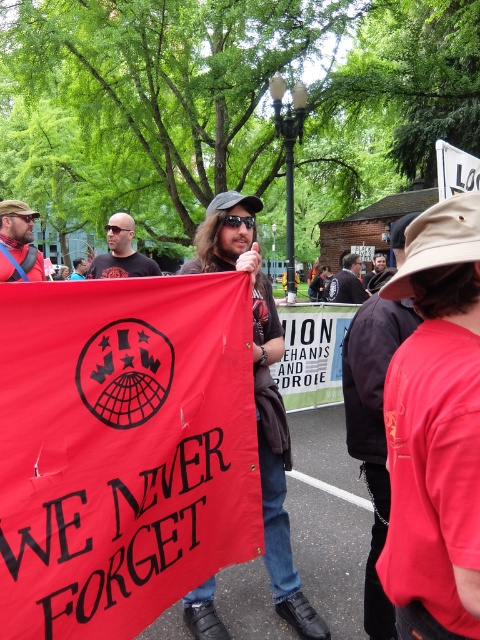
You are a photographer trying to capture the man holding the banner clearly. Since both the red cotton shirt at center and the red fabric banner at center are red, which object should you focus on to ensure the man is visible?

The red cotton shirt at center is in front of the red fabric banner at center, so focusing on the red cotton shirt at center will ensure the man is visible.

You are a photographer standing at the edge of the protest area. You want to take a photo of the matte black shirt at center. Where should you aim your camera to capture the shirt in the frame?

You should aim your camera at the coordinates point (261, 394) to capture the matte black shirt at center in the frame.